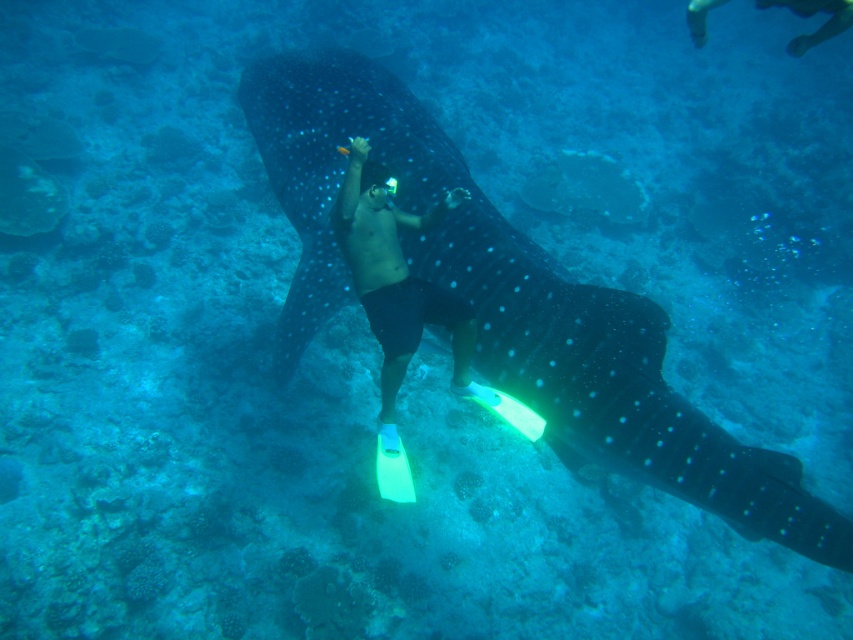
Between spotted dark blue skin at center and matte black shorts at center, which one has less height?

With less height is matte black shorts at center.

Is spotted dark blue skin at center below matte black shorts at center?

Yes.

Where is `spotted dark blue skin at center`? Image resolution: width=853 pixels, height=640 pixels. spotted dark blue skin at center is located at coordinates (511, 304).